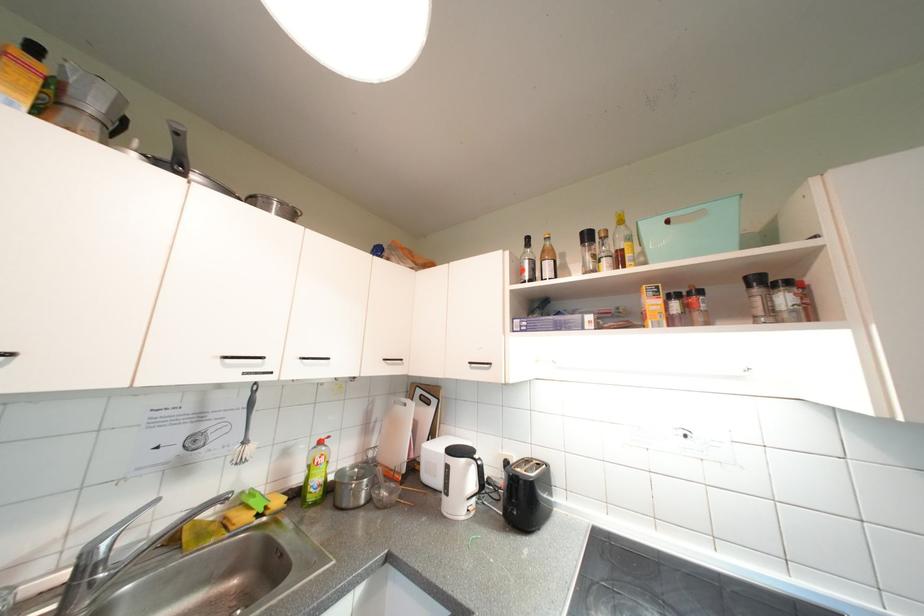
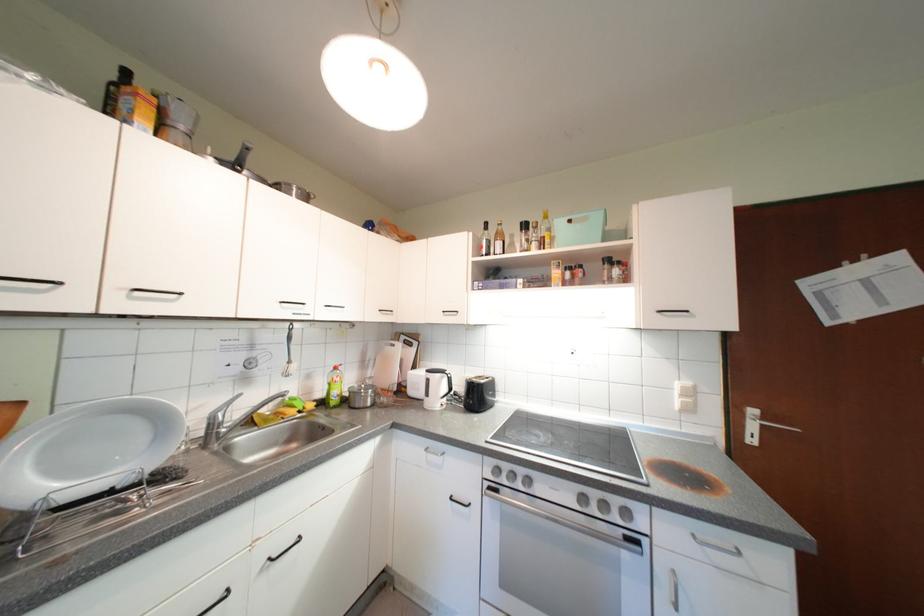
Find the pixel in the second image that matches (x=275, y=201) in the first image.

(298, 187)